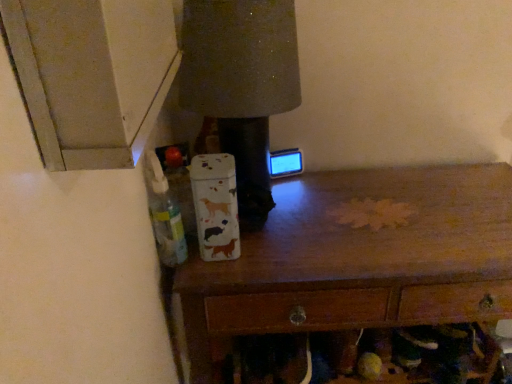
Where is `blank space situated above wooden chest of drawers at center (from a real-world perspective)`? blank space situated above wooden chest of drawers at center (from a real-world perspective) is located at coordinates (346, 223).